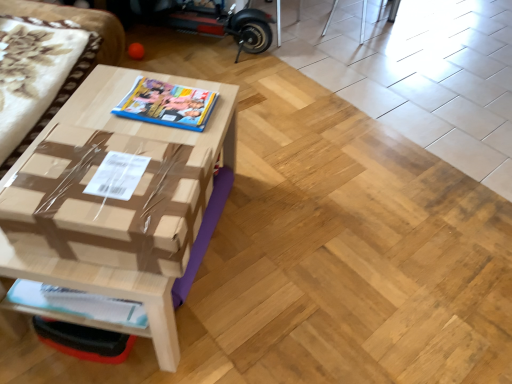
Locate an element on the screen. This screenshot has width=512, height=384. free spot in front of white glossy magazine at lower left, acting as the second magazine starting from the top is located at coordinates (68, 371).